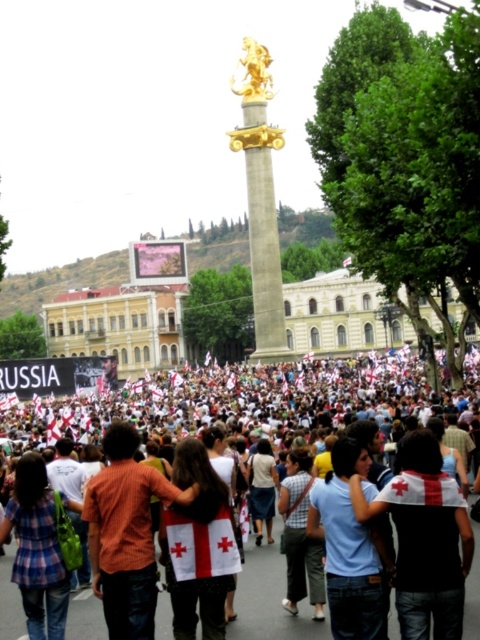
You are a photographer standing at the edge of the square and want to take a picture of the monument. There is a person wearing a white cotton shirt at center blocking your view. Where should you move to avoid the obstruction?

Move to the left or right of the white cotton shirt at center to avoid the obstruction since the person is directly in front of the monument at point (x=424, y=538).

You are a photographer trying to capture the monument in the center of the square. You notice the white fabric crowd at center and the orange shirt at center in your shot. Which object is wider in the frame?

The white fabric crowd at center is wider than the orange shirt at center.